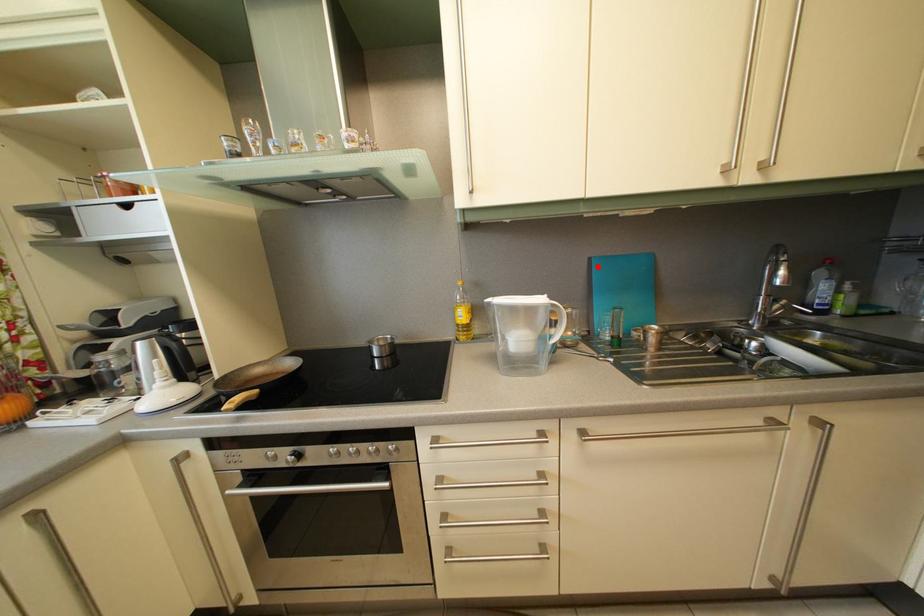
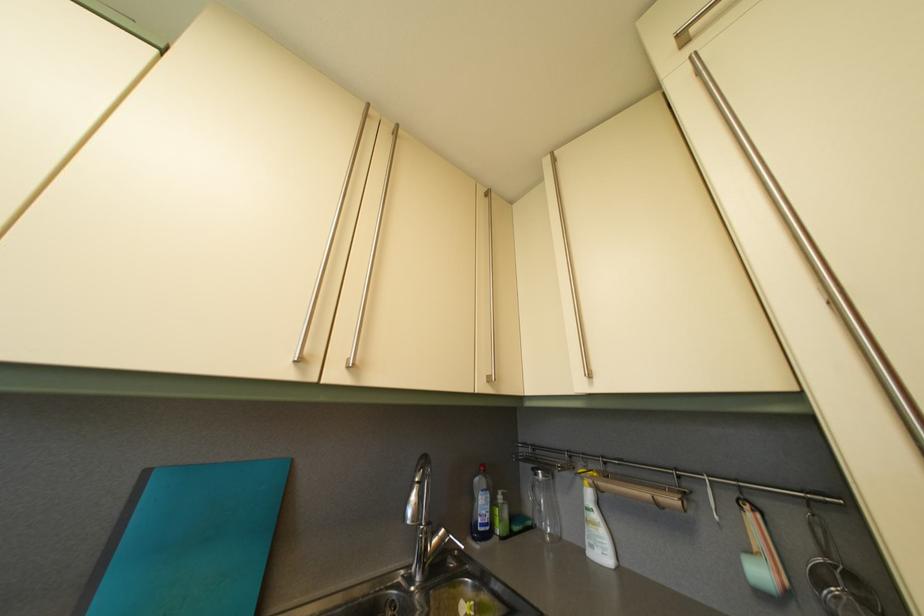
Where in the second image is the point corresponding to the highlighted location from the first image?

(154, 480)